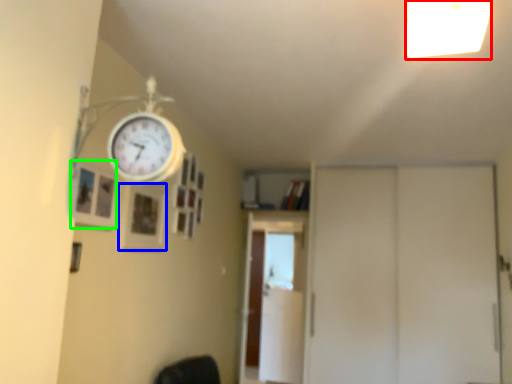
Question: Which is farther away from light fixture (highlighted by a red box)? picture frame (highlighted by a blue box) or picture frame (highlighted by a green box)?

Choices:
 (A) picture frame
 (B) picture frame

Answer: (A)